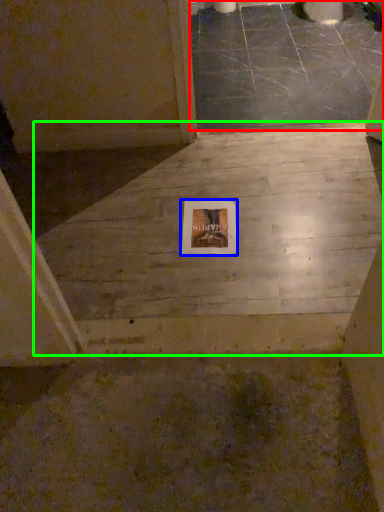
Question: Based on their relative distances, which object is farther from concrete (highlighted by a red box)? Choose from picture frame (highlighted by a blue box) and concrete (highlighted by a green box).

Choices:
 (A) picture frame
 (B) concrete

Answer: (A)